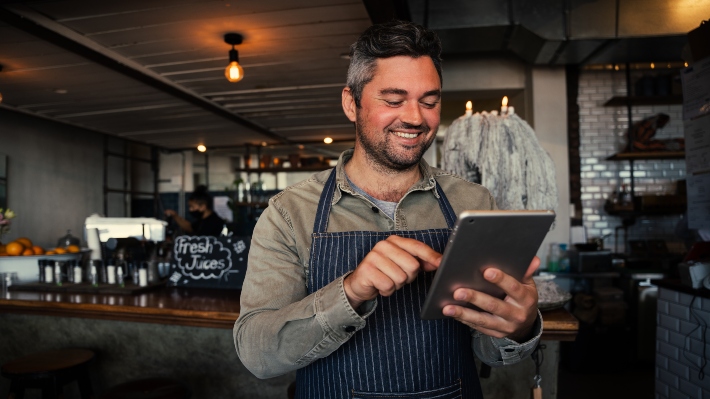
Identify the location of wooden counter. (104, 305), (187, 311), (551, 322), (672, 281), (701, 292).